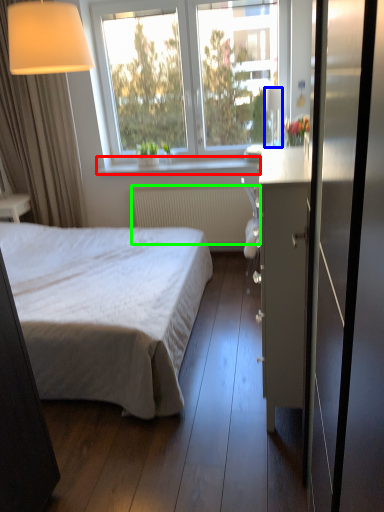
Question: Which object is the closest to the window sill (highlighted by a red box)? Choose among these: lamp (highlighted by a blue box) or radiator (highlighted by a green box).

Choices:
 (A) lamp
 (B) radiator

Answer: (B)